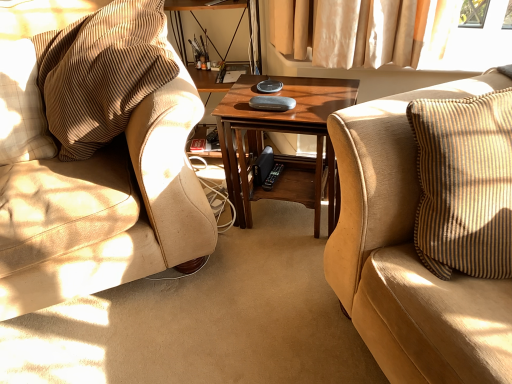
Question: Is beige textured pillow at left turned away from brown corduroy chair at left?

Choices:
 (A) no
 (B) yes

Answer: (B)

Question: Is brown corduroy chair at left a part of beige textured pillow at left?

Choices:
 (A) no
 (B) yes

Answer: (A)

Question: Considering the relative sizes of beige textured pillow at left and brown corduroy chair at left in the image provided, is beige textured pillow at left wider than brown corduroy chair at left?

Choices:
 (A) yes
 (B) no

Answer: (B)

Question: From a real-world perspective, is beige textured pillow at left under brown corduroy chair at left?

Choices:
 (A) no
 (B) yes

Answer: (B)

Question: Is beige textured pillow at left beside brown corduroy chair at left?

Choices:
 (A) yes
 (B) no

Answer: (B)

Question: Considering the positions of brown corduroy chair at left and suede beige couch at right in the image, is brown corduroy chair at left taller or shorter than suede beige couch at right?

Choices:
 (A) tall
 (B) short

Answer: (B)

Question: Considering the relative positions of brown corduroy chair at left and suede beige couch at right in the image provided, is brown corduroy chair at left to the left or to the right of suede beige couch at right?

Choices:
 (A) right
 (B) left

Answer: (B)

Question: In terms of width, does brown corduroy chair at left look wider or thinner when compared to suede beige couch at right?

Choices:
 (A) wide
 (B) thin

Answer: (B)

Question: Does point (146, 254) appear closer or farther from the camera than point (406, 286)?

Choices:
 (A) farther
 (B) closer

Answer: (A)

Question: Is beige textured pillow at left taller or shorter than wooden coffee table at center?

Choices:
 (A) tall
 (B) short

Answer: (B)

Question: Considering the positions of beige textured pillow at left and wooden coffee table at center in the image, is beige textured pillow at left bigger or smaller than wooden coffee table at center?

Choices:
 (A) small
 (B) big

Answer: (A)

Question: From the image's perspective, is beige textured pillow at left located above or below wooden coffee table at center?

Choices:
 (A) below
 (B) above

Answer: (B)

Question: Considering the positions of point tap(14, 59) and point tap(320, 94), is point tap(14, 59) closer or farther from the camera than point tap(320, 94)?

Choices:
 (A) farther
 (B) closer

Answer: (B)

Question: Is suede beige couch at right inside the boundaries of beige textured pillow at left, or outside?

Choices:
 (A) outside
 (B) inside

Answer: (A)

Question: Based on their positions, is suede beige couch at right located to the left or right of beige textured pillow at left?

Choices:
 (A) right
 (B) left

Answer: (A)